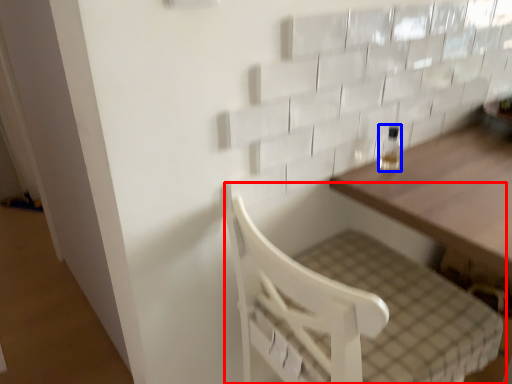
Question: Which object appears farthest to the camera in this image, furniture (highlighted by a red box) or bottle (highlighted by a blue box)?

Choices:
 (A) furniture
 (B) bottle

Answer: (B)